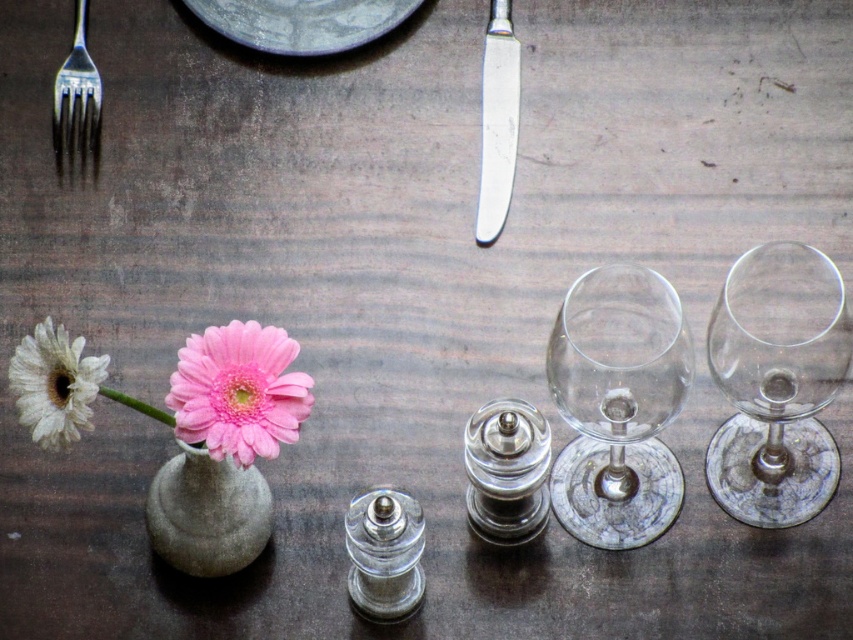
Question: Which of these objects is positioned closest to the metallic silver plate at upper center?

Choices:
 (A) silver metallic fork at upper left
 (B) silver metallic knife at upper center

Answer: (B)

Question: Among these points, which one is farthest from the camera?

Choices:
 (A) (256, 394)
 (B) (618, 390)
 (C) (503, 54)

Answer: (C)

Question: Can you confirm if transparent glass wine glass at center is smaller than white matte flower at left?

Choices:
 (A) yes
 (B) no

Answer: (B)

Question: Is transparent glass wine glass at center to the right of matte gray vase at lower left from the viewer's perspective?

Choices:
 (A) no
 (B) yes

Answer: (B)

Question: Can you confirm if transparent glass wine glass at center is positioned to the left of clear glass bottle at center?

Choices:
 (A) no
 (B) yes

Answer: (A)

Question: Which point is farther from the camera taking this photo?

Choices:
 (A) (248, 410)
 (B) (479, 180)

Answer: (B)